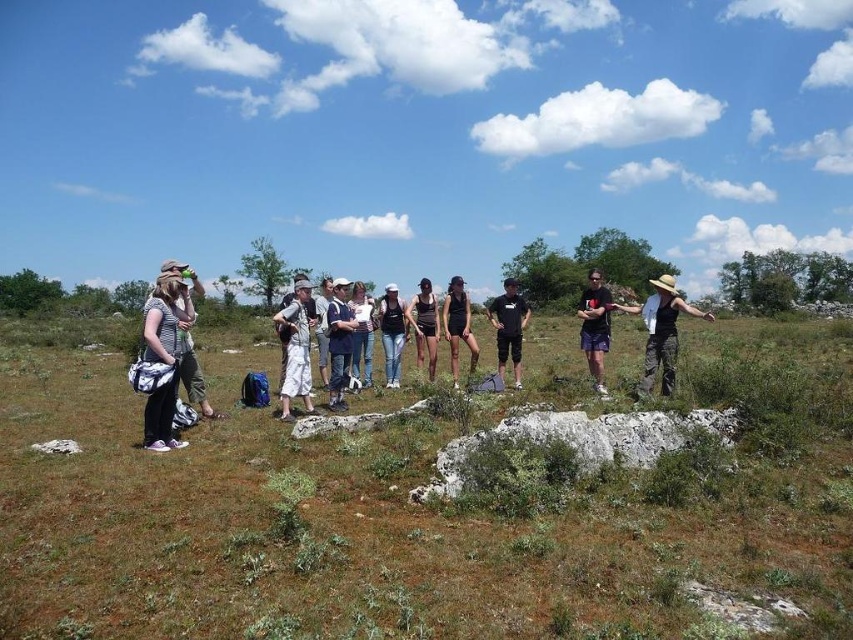
Based on the photo, you are standing in the open area and want to take a photo of the green grassy field at center and the white cotton shirt at center. Which object should you focus on first to ensure both are in focus?

The green grassy field at center is in front of the white cotton shirt at center, so you should focus on the green grassy field at center first to ensure both are in focus.

You are part of the group in the image and want to take a photo of the black matte dress at center without the white rough rock at center blocking the view. Which direction should you move to achieve this?

Move behind the black matte dress at center so that the white rough rock at center is no longer in front of it, allowing an unobstructed view of the dress.